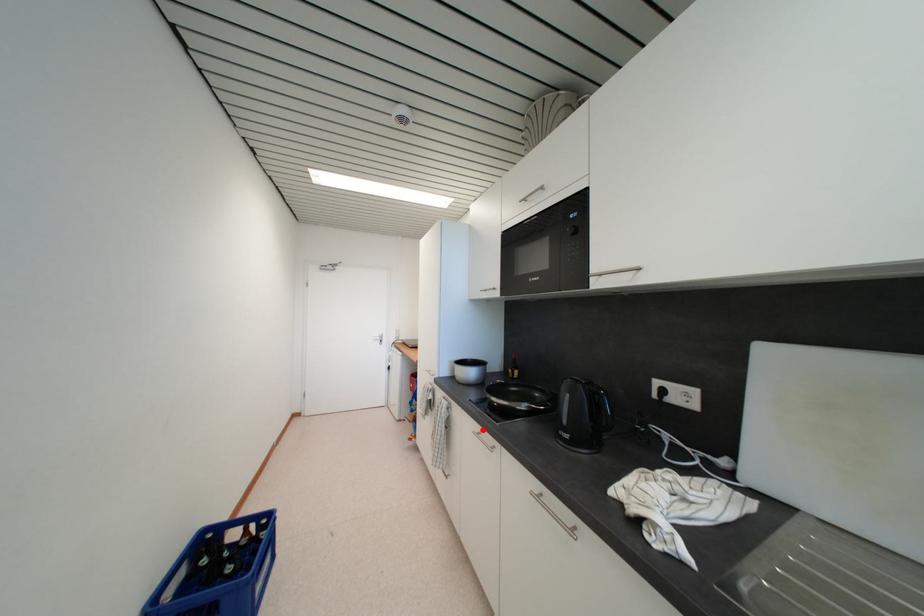
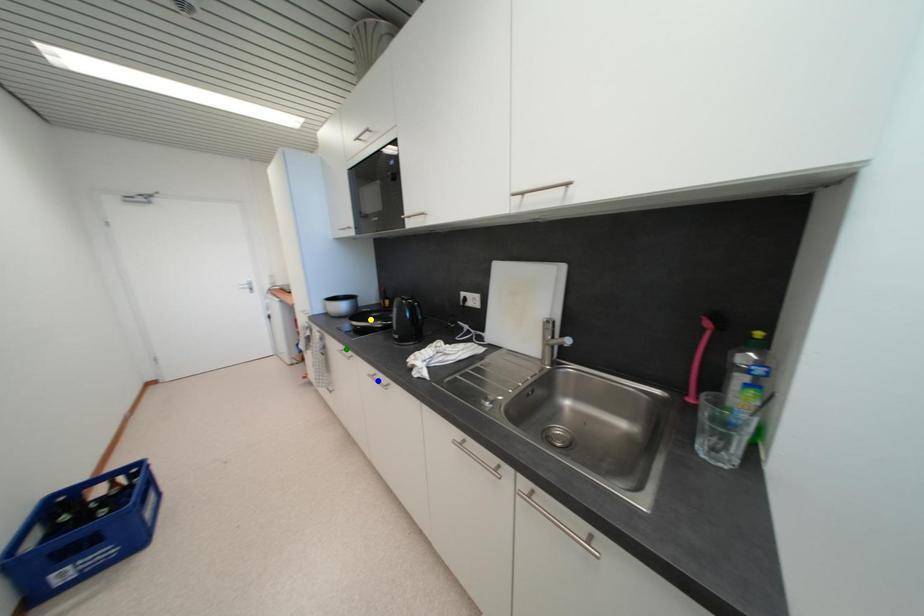
Question: I am providing you with two images of the same scene from different viewpoints. A red point is marked on the first image. You are given multiple points on the second image. Can you choose the point in image 2 that corresponds to the point in image 1?

Choices:
 (A) yellow point
 (B) blue point
 (C) green point

Answer: (C)